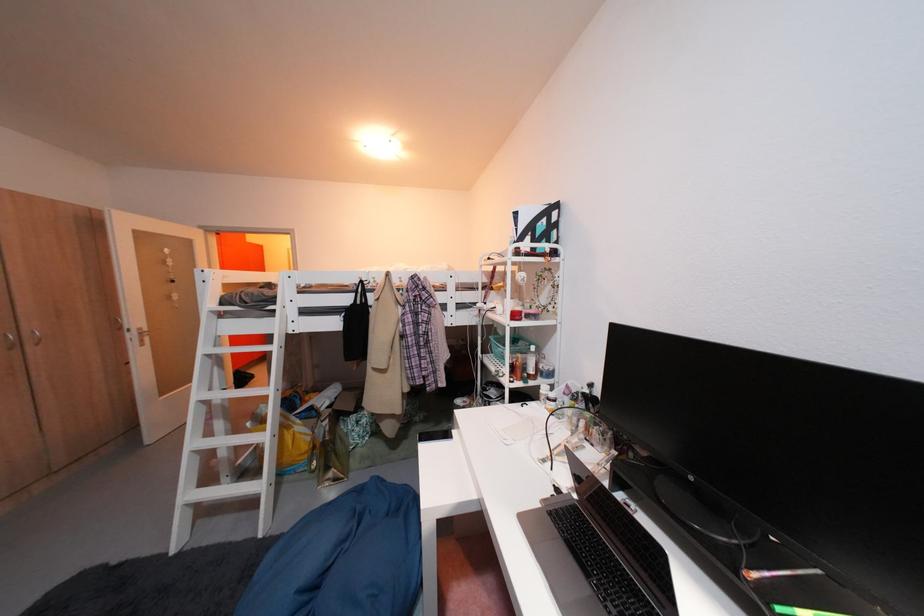
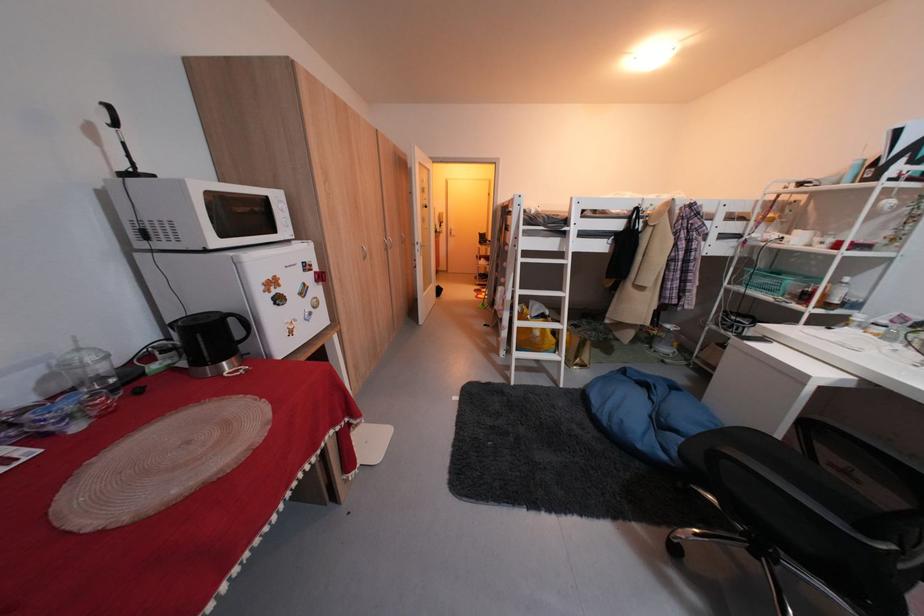
In the second image, find the point that corresponds to [138,331] in the first image.

(428, 245)